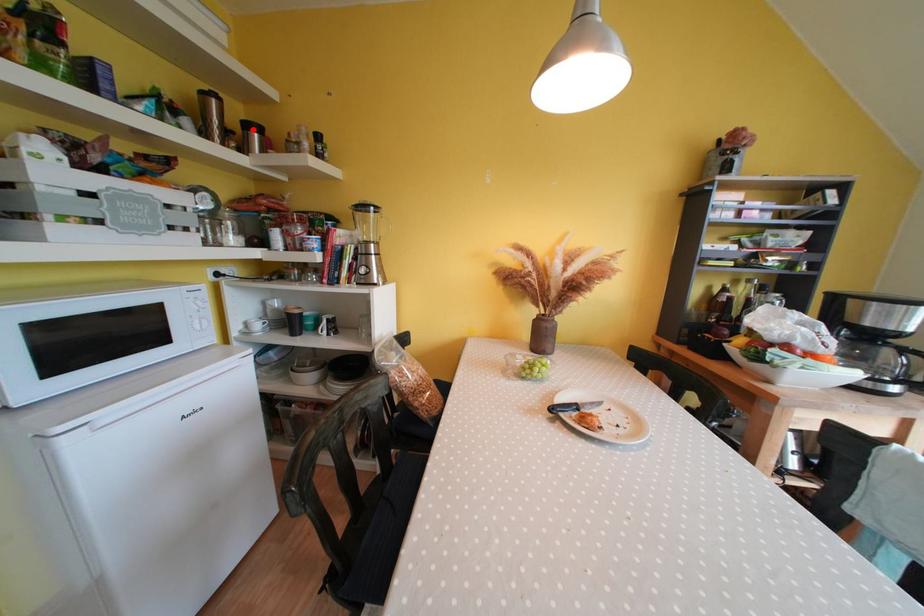
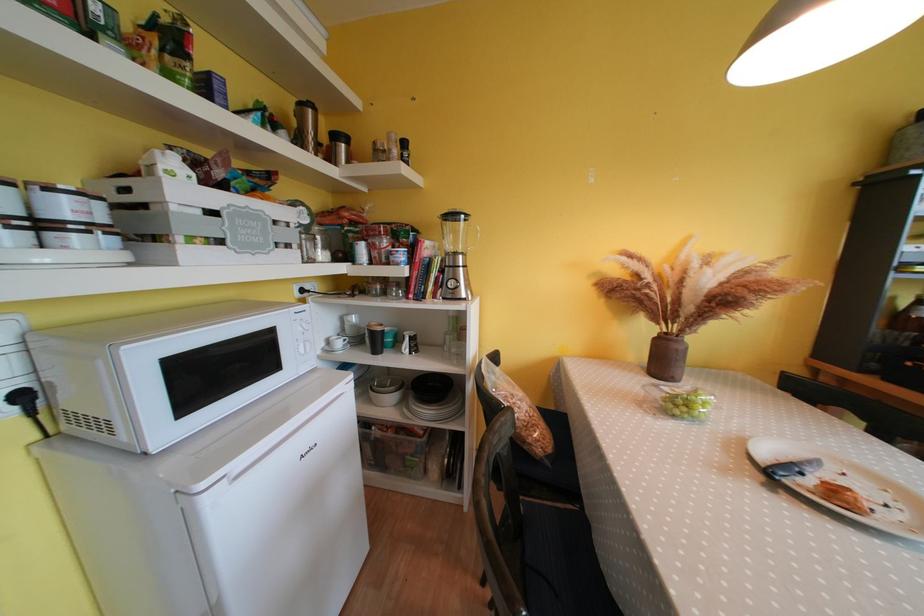
The point at the highlighted location is marked in the first image. Where is the corresponding point in the second image?

(342, 140)